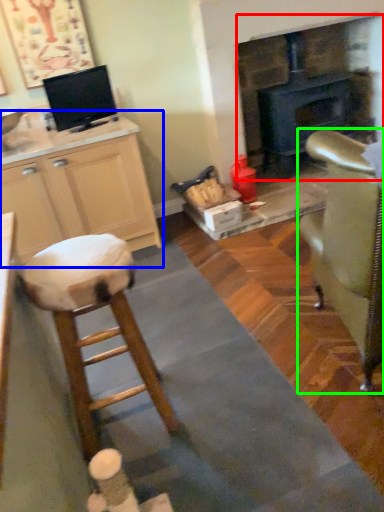
Question: Considering the real-world distances, which object is farthest from fireplace (highlighted by a red box)? cabinetry (highlighted by a blue box) or chair (highlighted by a green box)?

Choices:
 (A) cabinetry
 (B) chair

Answer: (B)